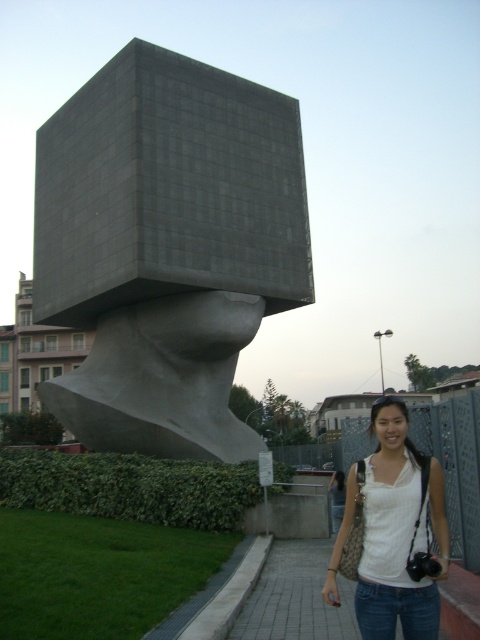
Question: Among these objects, which one is farthest from the camera?

Choices:
 (A) paved stone sidewalk at lower center
 (B) matte gray cube at center
 (C) white fabric at center

Answer: (B)

Question: Which object is farther from the camera taking this photo?

Choices:
 (A) white fabric at center
 (B) matte gray cube at center
 (C) paved stone sidewalk at lower center

Answer: (B)

Question: Does matte gray cube at center have a lesser width compared to paved stone sidewalk at lower center?

Choices:
 (A) no
 (B) yes

Answer: (A)

Question: Does matte gray cube at center have a larger size compared to white fabric at center?

Choices:
 (A) yes
 (B) no

Answer: (A)

Question: Does white fabric at center appear under paved stone sidewalk at lower center?

Choices:
 (A) no
 (B) yes

Answer: (A)

Question: Estimate the real-world distances between objects in this image. Which object is farther from the white fabric at center?

Choices:
 (A) matte gray cube at center
 (B) paved stone sidewalk at lower center

Answer: (A)